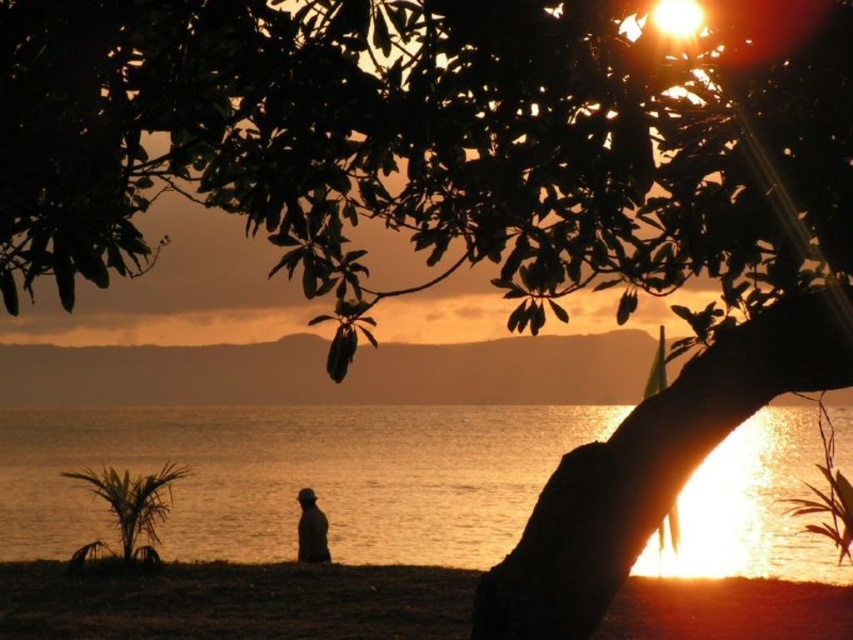
Can you confirm if golden reflective water at center is taller than silhouette figure at lower center?

Correct, golden reflective water at center is much taller as silhouette figure at lower center.

Is golden reflective water at center to the left of silhouette figure at lower center from the viewer's perspective?

Yes, golden reflective water at center is to the left of silhouette figure at lower center.

Is point (207, 513) positioned before point (311, 548)?

Yes, it is.

At what (x,y) coordinates should I click in order to perform the action: click on golden reflective water at center. Please return your answer as a coordinate pair (x, y). This screenshot has width=853, height=640. Looking at the image, I should click on (294, 476).

Can you confirm if brown sand at lower center is bigger than silhouette figure at lower center?

Indeed, brown sand at lower center has a larger size compared to silhouette figure at lower center.

Is point (10, 596) in front of point (306, 541)?

Yes, point (10, 596) is closer to viewer.

Image resolution: width=853 pixels, height=640 pixels. Identify the location of brown sand at lower center. (234, 602).

Between golden reflective water at center and brown sand at lower center, which one is positioned lower?

brown sand at lower center is lower down.

Can you confirm if golden reflective water at center is positioned to the left of brown sand at lower center?

No, golden reflective water at center is not to the left of brown sand at lower center.

Is point (361, 548) positioned behind point (289, 598)?

Yes.

Identify the location of golden reflective water at center. The image size is (853, 640). (294, 476).